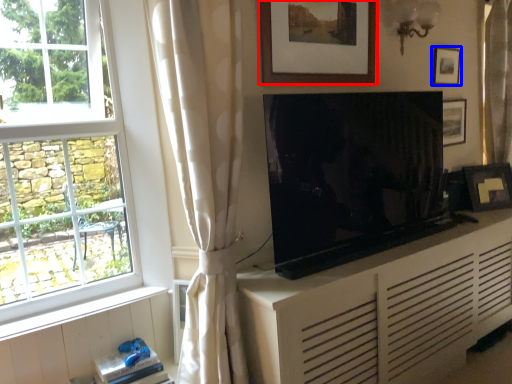
Question: Which object is closer to the camera taking this photo, picture frame (highlighted by a red box) or picture frame (highlighted by a blue box)?

Choices:
 (A) picture frame
 (B) picture frame

Answer: (A)